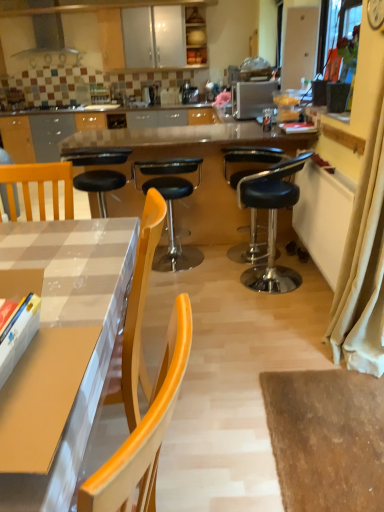
Describe the element at coordinates (49, 42) in the screenshot. I see `metallic silver range hood at upper center` at that location.

Measure the distance between black leather stool at center, arranged as the second chair when viewed from the left, and camera.

A distance of 3.20 meters exists between black leather stool at center, arranged as the second chair when viewed from the left, and camera.

Image resolution: width=384 pixels, height=512 pixels. What do you see at coordinates (4, 199) in the screenshot? I see `wooden chair at left` at bounding box center [4, 199].

The width and height of the screenshot is (384, 512). What are the coordinates of `beige fabric curtain at right` in the screenshot? It's located at (363, 264).

This screenshot has height=512, width=384. I want to click on metallic silver range hood at upper center, so click(49, 42).

In the scene shown: Would you say metallic silver toaster at upper center is inside or outside black leather stool at center, arranged as the second chair when viewed from the left?

metallic silver toaster at upper center is outside black leather stool at center, arranged as the second chair when viewed from the left.

Based on the photo, is metallic silver toaster at upper center shorter than black leather stool at center, arranged as the second chair when viewed from the left?

Yes.

Is metallic silver toaster at upper center next to black leather stool at center, which is counted as the second chair, starting from the right?

There is a gap between metallic silver toaster at upper center and black leather stool at center, which is counted as the second chair, starting from the right.

Is metallic silver toaster at upper center thinner than black leather stool at center, arranged as the second chair when viewed from the left?

No.

Is metallic silver toaster at upper center positioned with its back to white paper at center?

No, metallic silver toaster at upper center's orientation is not away from white paper at center.

Who is smaller, metallic silver toaster at upper center or white paper at center?

white paper at center is smaller.

Would you say metallic silver toaster at upper center is inside or outside white paper at center?

metallic silver toaster at upper center cannot be found inside white paper at center.

Is metallic silver toaster at upper center not near white paper at center?

No, metallic silver toaster at upper center is not far from white paper at center.

Would you say orange plastic chair at center, which is the 1th chair from left to right, is inside or outside white glossy table at center?

orange plastic chair at center, which is the 1th chair from left to right, is inside white glossy table at center.

Considering the sizes of objects orange plastic chair at center, which is the 1th chair from left to right, and white glossy table at center in the image provided, who is bigger, orange plastic chair at center, which is the 1th chair from left to right, or white glossy table at center?

white glossy table at center is bigger.

From the image's perspective, is orange plastic chair at center, which is the 1th chair from left to right, above white glossy table at center?

No, from the image's perspective, orange plastic chair at center, which is the 1th chair from left to right, is not over white glossy table at center.

Locate an element on the screen. The width and height of the screenshot is (384, 512). round table that appears on the right of orange plastic chair at center, which is the third chair from right to left is located at coordinates (202, 166).

Which of these two, black leather stool at center, which is the third chair in left-to-right order, or beige fabric curtain at right, is smaller?

Smaller between the two is beige fabric curtain at right.

From the image's perspective, would you say black leather stool at center, which is counted as the first chair, starting from the right, is shown under beige fabric curtain at right?

No, from the image's perspective, black leather stool at center, which is counted as the first chair, starting from the right, is not below beige fabric curtain at right.

Which is in front, black leather stool at center, which is the third chair in left-to-right order, or beige fabric curtain at right?

beige fabric curtain at right is more forward.

Between metallic silver toaster at upper center and metallic silver range hood at upper center, which one has smaller width?

Thinner between the two is metallic silver range hood at upper center.

From a real-world perspective, which object rests below the other?

metallic silver toaster at upper center, from a real-world perspective.

From the image's perspective, between metallic silver toaster at upper center and metallic silver range hood at upper center, who is located below?

metallic silver toaster at upper center is shown below in the image.

How far apart are metallic silver toaster at upper center and metallic silver range hood at upper center?

They are 10.31 feet apart.

Based on the photo, looking at their sizes, would you say white paper at center is wider or thinner than beige fabric curtain at right?

Considering their sizes, white paper at center looks slimmer than beige fabric curtain at right.

Does white paper at center appear on the left side of beige fabric curtain at right?

Indeed, white paper at center is positioned on the left side of beige fabric curtain at right.

Consider the image. Would you say white paper at center is outside beige fabric curtain at right?

That's correct, white paper at center is outside of beige fabric curtain at right.

In order to click on curtain beneath the white paper at center (from a real-world perspective) in this screenshot , I will do `click(363, 264)`.

From the image's perspective, which is above, black leather stool at center, which is counted as the second chair, starting from the right, or black leather stool at center, which is the third chair in left-to-right order?

From the image's view, black leather stool at center, which is counted as the second chair, starting from the right, is above.

Which object is thinner, black leather stool at center, which is counted as the second chair, starting from the right, or black leather stool at center, which is counted as the first chair, starting from the right?

black leather stool at center, which is counted as the second chair, starting from the right, is thinner.

From a real-world perspective, who is located higher, black leather stool at center, arranged as the second chair when viewed from the left, or black leather stool at center, which is the third chair in left-to-right order?

From a 3D spatial view, black leather stool at center, which is the third chair in left-to-right order, is above.

At what (x,y) coordinates should I click in order to perform the action: click on chair that is the 2nd one below the metallic silver toaster at upper center (from a real-world perspective). Please return your answer as a coordinate pair (x, y). Image resolution: width=384 pixels, height=512 pixels. Looking at the image, I should click on (250, 160).

The width and height of the screenshot is (384, 512). I want to click on appliance that is above the white paper at center (from the image's perspective), so click(x=252, y=98).

Considering their positions, is black leather stool at center, arranged as the second chair when viewed from the left, positioned closer to beige fabric curtain at right than white paper at center?

white paper at center.

Based on their spatial positions, is wooden chair at left or metallic silver range hood at upper center closer to white paper at center?

wooden chair at left lies closer to white paper at center than the other object.

From the image, which object appears to be farther from white paper at center, white glossy table at lower left or wooden chair at left?

Among the two, wooden chair at left is located further to white paper at center.

Considering their positions, is black leather stool at center, which is the third chair in left-to-right order, positioned closer to black leather stool at center, which is counted as the second chair, starting from the right, than white glossy table at center?

white glossy table at center lies closer to black leather stool at center, which is counted as the second chair, starting from the right, than the other object.

From the image, which object appears to be farther from black leather stool at center, which is counted as the second chair, starting from the right, white paper at center or metallic silver range hood at upper center?

Based on the image, metallic silver range hood at upper center appears to be further to black leather stool at center, which is counted as the second chair, starting from the right.

Considering their positions, is orange plastic chair at center, which is the third chair from right to left, positioned closer to white glossy table at center than metallic silver toaster at upper center?

orange plastic chair at center, which is the third chair from right to left, is positioned closer to the anchor white glossy table at center.

From the picture: Looking at the image, which one is located closer to white glossy table at center, orange plastic chair at center, which is the third chair from right to left, or black leather stool at center, arranged as the second chair when viewed from the left?

orange plastic chair at center, which is the third chair from right to left, is positioned closer to the anchor white glossy table at center.

When comparing their distances from orange plastic chair at center, which is the third chair from right to left, does metallic silver range hood at upper center or black leather stool at center, arranged as the second chair when viewed from the left, seem further?

metallic silver range hood at upper center is further to orange plastic chair at center, which is the third chair from right to left.

You are a GUI agent. You are given a task and a screenshot of the screen. Output one action in this format:
    pyautogui.click(x=<x>, y=<y>)
    Task: Click on the chair positioned between white glossy table at lower left and orange plastic chair at center, which is the third chair from right to left, from near to far
    
    Given the screenshot: What is the action you would take?
    pyautogui.click(x=271, y=221)

Where is `round table between metallic silver toaster at upper center and orange plastic chair at center, which is the 1th chair from left to right, in the up-down direction`? round table between metallic silver toaster at upper center and orange plastic chair at center, which is the 1th chair from left to right, in the up-down direction is located at coordinates (202, 166).

This screenshot has width=384, height=512. In order to click on round table positioned between beige fabric curtain at right and metallic silver range hood at upper center from near to far in this screenshot , I will do `click(202, 166)`.

The width and height of the screenshot is (384, 512). In order to click on chair between metallic silver range hood at upper center and orange plastic chair at center, which is the 1th chair from left to right, in the up-down direction in this screenshot , I will do `click(250, 160)`.